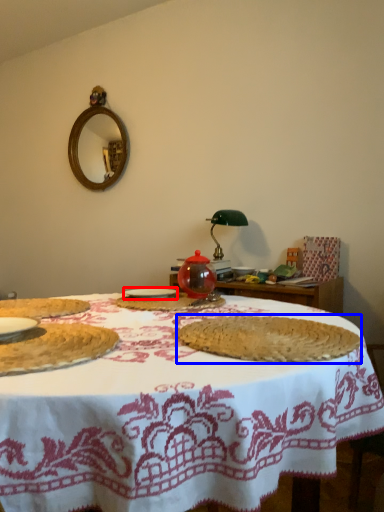
Question: Which object is further to the camera taking this photo, tableware (highlighted by a red box) or food (highlighted by a blue box)?

Choices:
 (A) tableware
 (B) food

Answer: (A)